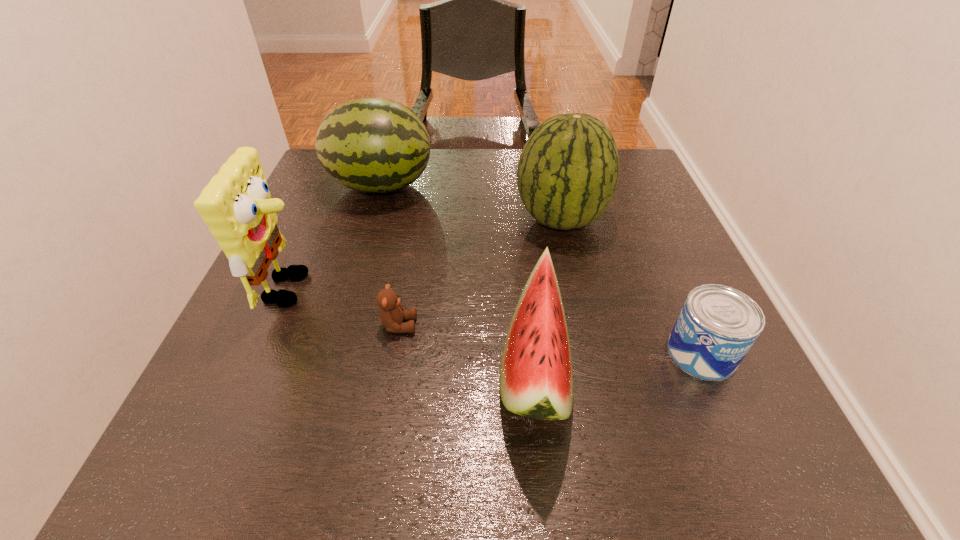
Where is `sponge`? Image resolution: width=960 pixels, height=540 pixels. sponge is located at coordinates 236,205.

Find the location of a particular element. This screenshot has width=960, height=540. the leftmost watermelon is located at coordinates (373, 145).

Where is `the nearest watermelon`? the nearest watermelon is located at coordinates (536, 376).

Where is `the third shortest object`? The height and width of the screenshot is (540, 960). the third shortest object is located at coordinates (536, 376).

At what (x,y) coordinates should I click in order to perform the action: click on can. Please return your answer as a coordinate pair (x, y). Image resolution: width=960 pixels, height=540 pixels. Looking at the image, I should click on (717, 326).

Identify the location of the fifth tallest object. (717, 326).

Find the location of a particular element. The width and height of the screenshot is (960, 540). the shortest object is located at coordinates (392, 313).

Identify the location of free space located on the face of the sponge. Image resolution: width=960 pixels, height=540 pixels. (487, 289).

Where is `free spot located 0.310m at the stem end of the leftmost watermelon`? This screenshot has width=960, height=540. free spot located 0.310m at the stem end of the leftmost watermelon is located at coordinates (550, 186).

Locate an element on the screen. Image resolution: width=960 pixels, height=540 pixels. free space located 0.250m on the outer rind of the shortest watermelon is located at coordinates click(352, 369).